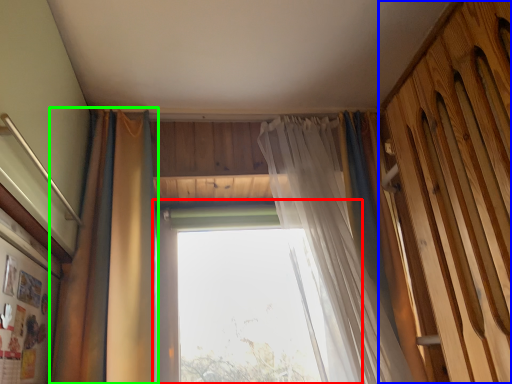
Question: Which object is the farthest from window (highlighted by a red box)? Choose among these: barn door (highlighted by a blue box) or curtain (highlighted by a green box).

Choices:
 (A) barn door
 (B) curtain

Answer: (A)